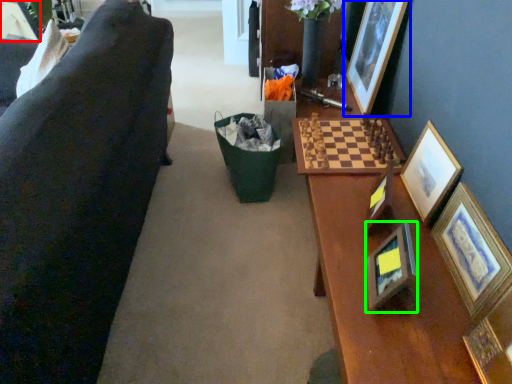
Question: Estimate the real-world distances between objects in this image. Which object is farther from picture frame (highlighted by a red box), picture frame (highlighted by a blue box) or picture frame (highlighted by a green box)?

Choices:
 (A) picture frame
 (B) picture frame

Answer: (B)